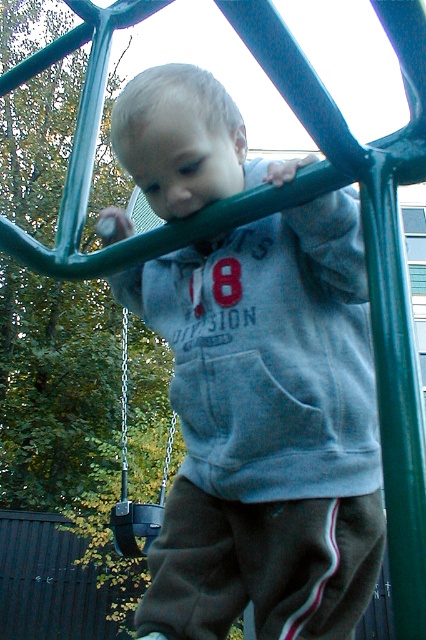
You are standing at the point marked by the coordinates point (131, 172) and want to throw a ball to a friend who is standing 1.5 meters away from you. Can you reach your friend with a single throw?

The distance between you and your friend is 1.5 meters, but the point (131, 172) is only 1.07 meters away from the viewer. Therefore, you can easily reach your friend with a single throw since 1.5 meters is within your throwing range.

You are a parent trying to ensure your child is safe while playing. The child is wearing a gray fleece sweatshirt at center and is near a black plastic swing at center. Which item is covering the other?

The gray fleece sweatshirt at center is positioned over the black plastic swing at center, so the sweatshirt is covering the swing.

What are the coordinates of the gray fleece sweatshirt at center?

The gray fleece sweatshirt at center is located at point (267, 428).